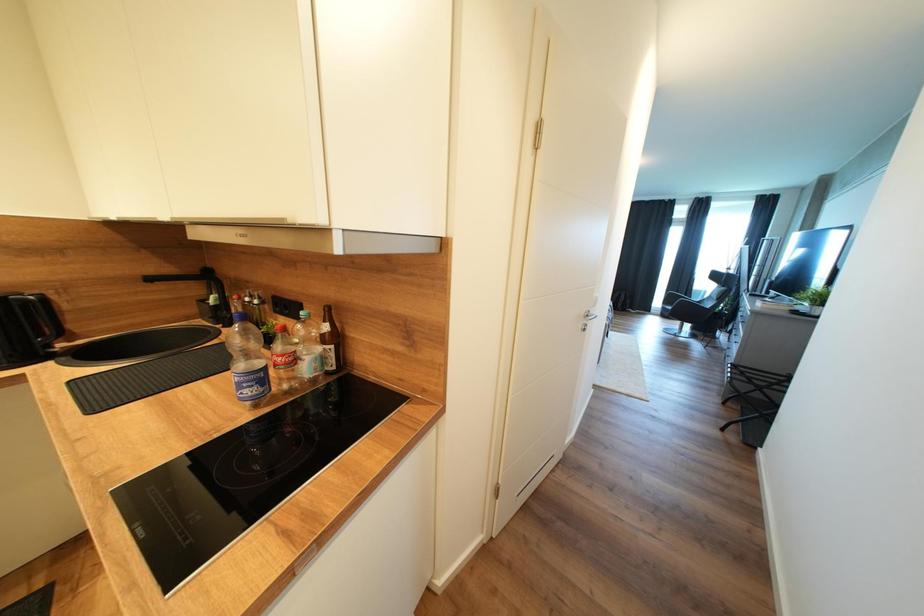
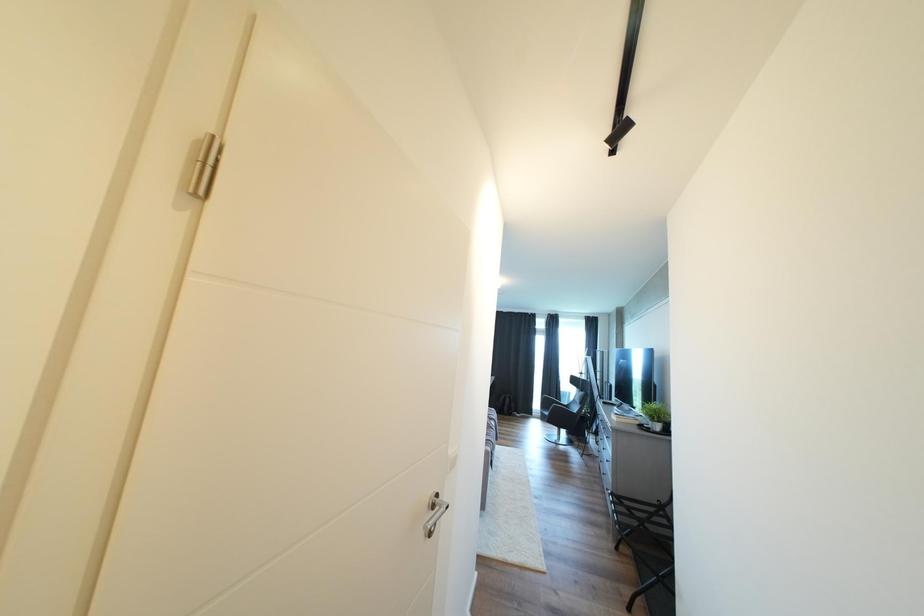
Based on the continuous images, in which direction is the camera rotating?

The rotation direction of the camera is right-up.